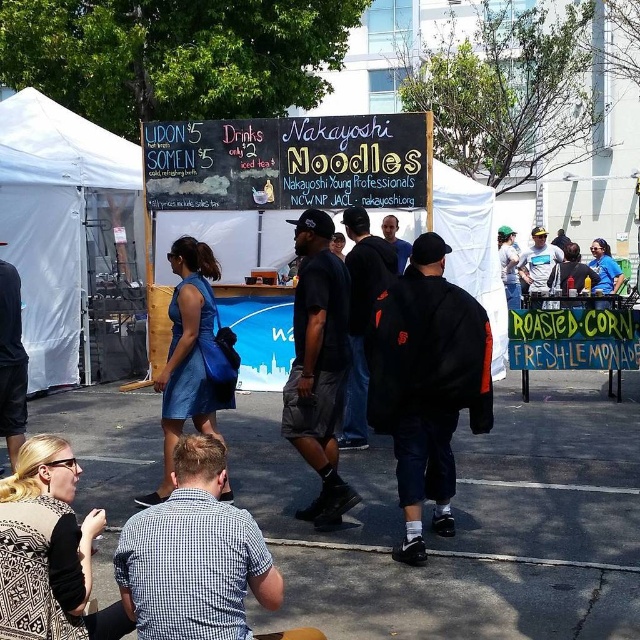
Question: Based on their relative distances, which object is nearer to the black matte jacket at center?

Choices:
 (A) black matte shorts at center
 (B) blue jersey at right
 (C) white fabric tent at left

Answer: (A)

Question: Considering the relative positions of white fabric tent at left and blue jersey at right in the image provided, where is white fabric tent at left located with respect to blue jersey at right?

Choices:
 (A) left
 (B) right

Answer: (A)

Question: Which object is positioned closest to the black matte jacket at center?

Choices:
 (A) blue denim dress at center
 (B) blue jersey at right

Answer: (A)

Question: Can you confirm if white fabric tent at left is smaller than blue jersey at right?

Choices:
 (A) yes
 (B) no

Answer: (B)

Question: Which object is positioned farthest from the blue denim dress at center?

Choices:
 (A) white fabric tent at left
 (B) black matte shorts at center

Answer: (A)

Question: Does black matte shorts at center appear over blue denim dress at center?

Choices:
 (A) no
 (B) yes

Answer: (B)